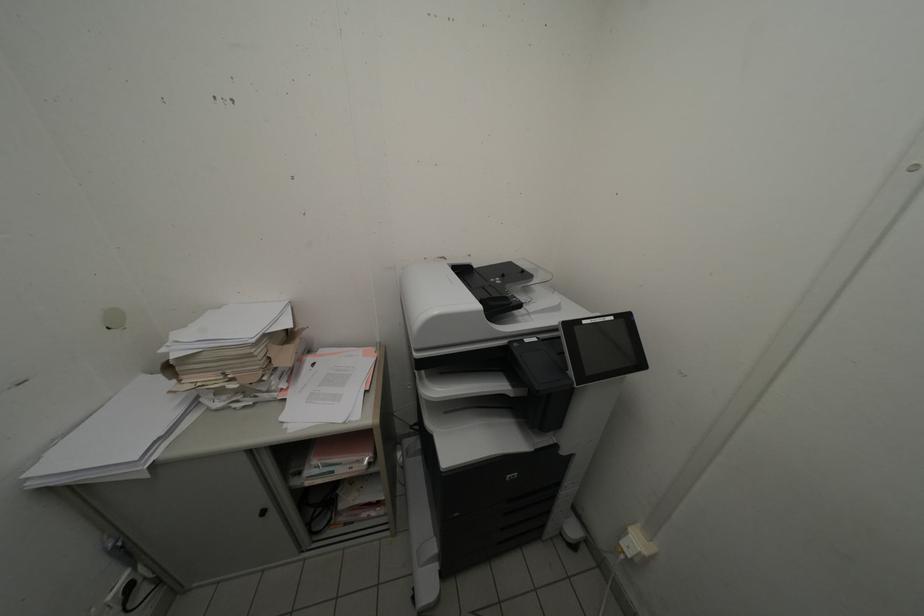
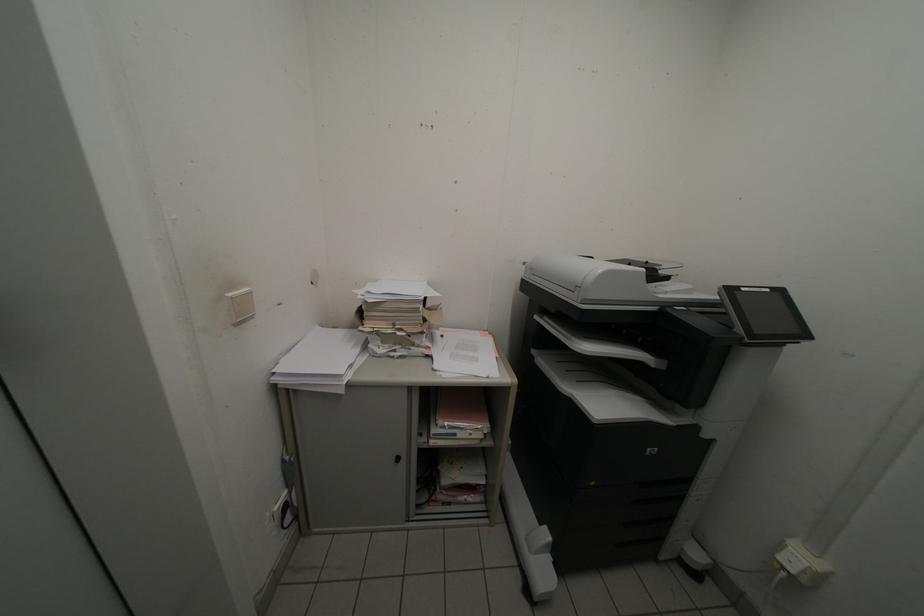
Question: The images are taken continuously from a first-person perspective. In which direction is your viewpoint rotating?

Choices:
 (A) Left
 (B) Right
 (C) Up
 (D) Down

Answer: (C)